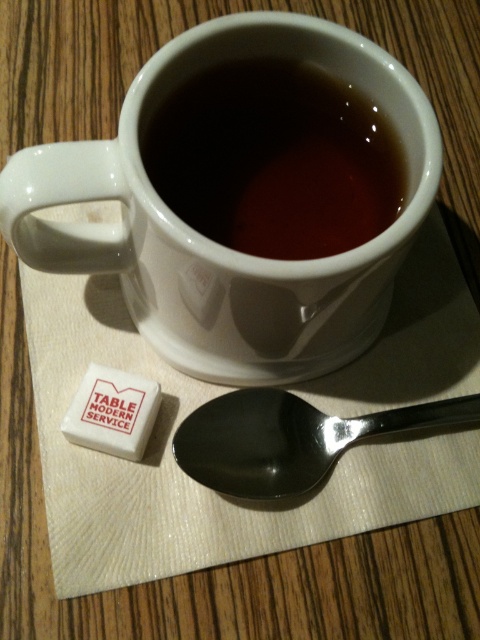
Between white ceramic mug at upper center and polished metal spoon at lower center, which one has more height?

Standing taller between the two is white ceramic mug at upper center.

Describe the element at coordinates (218, 244) in the screenshot. The width and height of the screenshot is (480, 640). I see `white ceramic mug at upper center` at that location.

Who is more forward, (313,340) or (208,413)?

Positioned in front is point (313,340).

At what (x,y) coordinates should I click in order to perform the action: click on white ceramic mug at upper center. Please return your answer as a coordinate pair (x, y). This screenshot has width=480, height=640. Looking at the image, I should click on (218, 244).

Who is more distant from viewer, (x=252, y=112) or (x=231, y=426)?

The point (x=231, y=426) is more distant.

Does point (243, 161) lie in front of point (295, 403)?

Yes, point (243, 161) is closer to viewer.

The image size is (480, 640). I want to click on matte ceramic mug at upper center, so (275, 161).

Is white ceramic mug at upper center below matte ceramic mug at upper center?

Yes, white ceramic mug at upper center is below matte ceramic mug at upper center.

Between white ceramic mug at upper center and matte ceramic mug at upper center, which one is positioned lower?

white ceramic mug at upper center is below.

The width and height of the screenshot is (480, 640). Find the location of `white ceramic mug at upper center`. white ceramic mug at upper center is located at coordinates (218, 244).